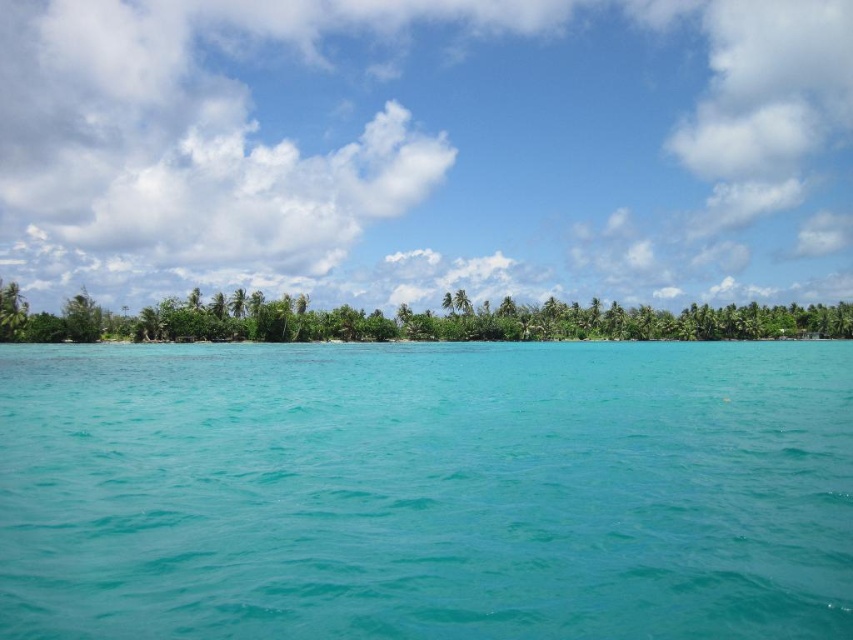
Question: Does turquoise glossy water at center have a greater width compared to green leafy trees at center?

Choices:
 (A) yes
 (B) no

Answer: (B)

Question: Does turquoise glossy water at center appear on the left side of green leafy trees at center?

Choices:
 (A) yes
 (B) no

Answer: (A)

Question: Which point is farther to the camera?

Choices:
 (A) green leafy trees at center
 (B) turquoise glossy water at center

Answer: (A)

Question: Among these objects, which one is farthest from the camera?

Choices:
 (A) green leafy trees at center
 (B) turquoise glossy water at center

Answer: (A)

Question: Is turquoise glossy water at center positioned at the back of green leafy trees at center?

Choices:
 (A) yes
 (B) no

Answer: (B)